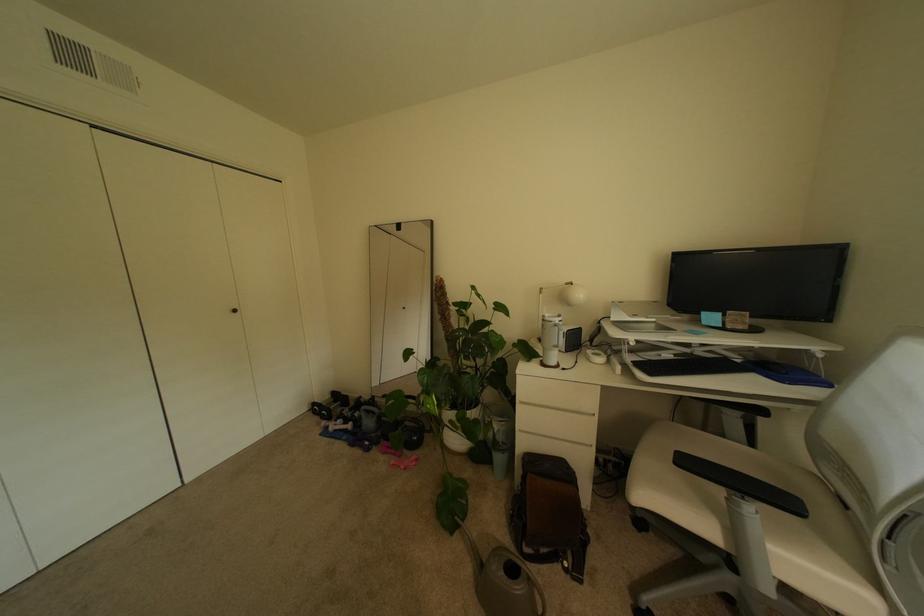
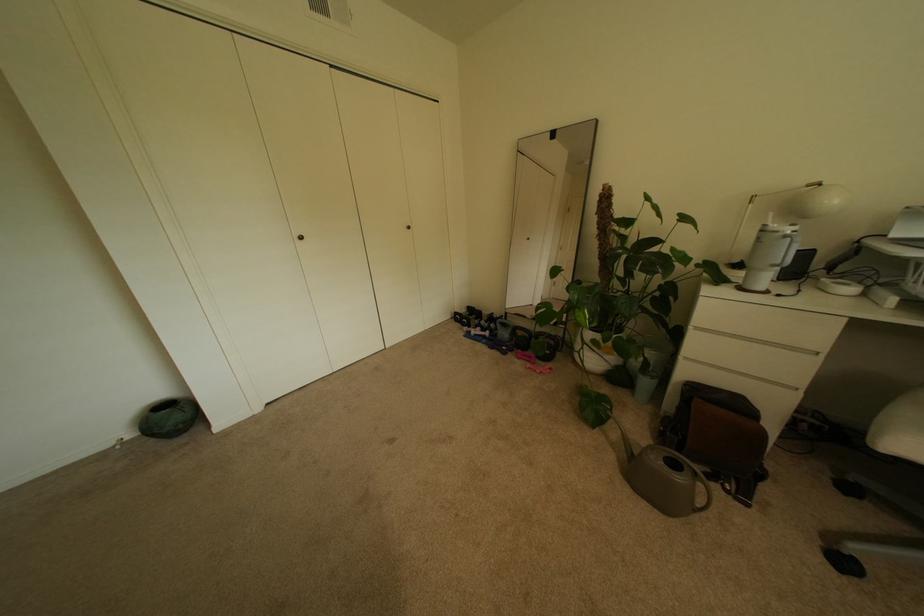
Locate, in the second image, the point that corresponds to [511,424] in the first image.

(661, 353)